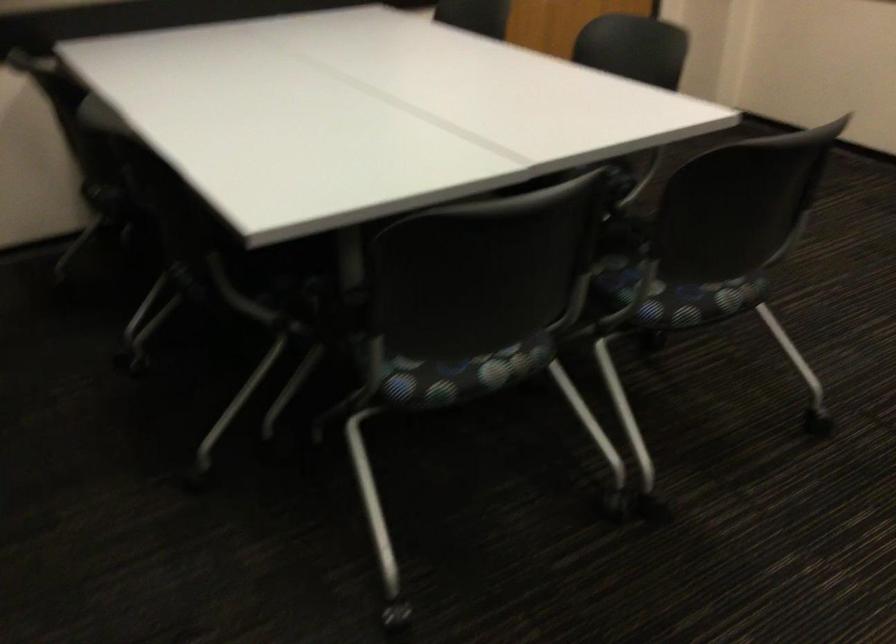
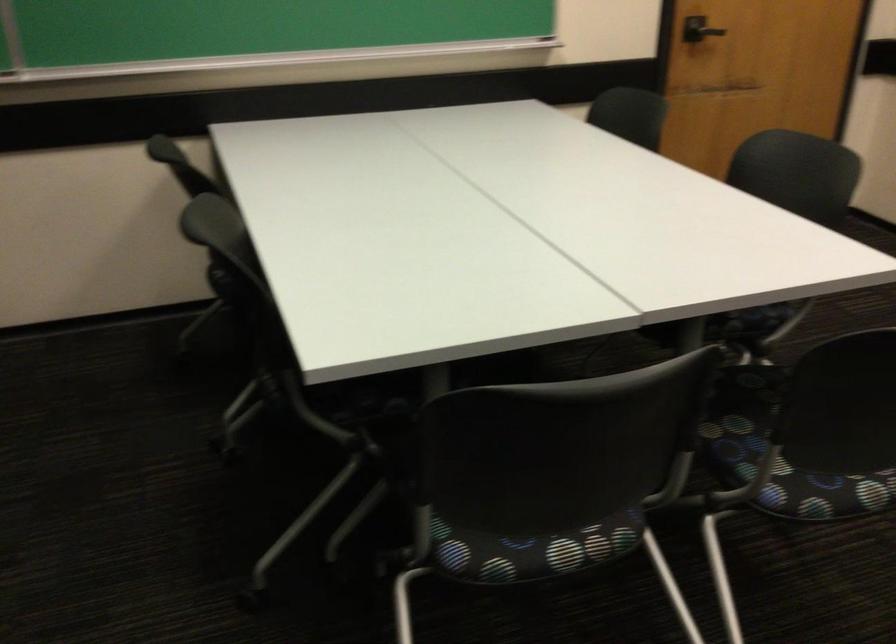
Where in the second image is the point corresponding to the point at 470,373 from the first image?

(531, 550)